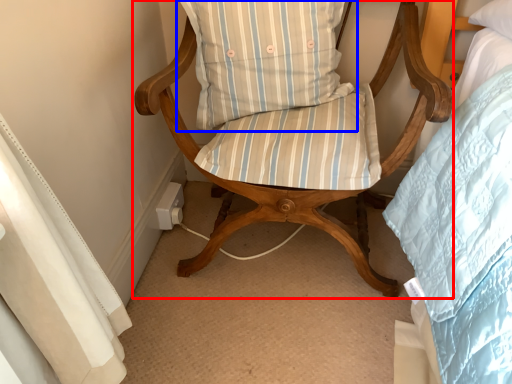
Question: Which object is closer to the camera taking this photo, chair (highlighted by a red box) or pillow (highlighted by a blue box)?

Choices:
 (A) chair
 (B) pillow

Answer: (A)